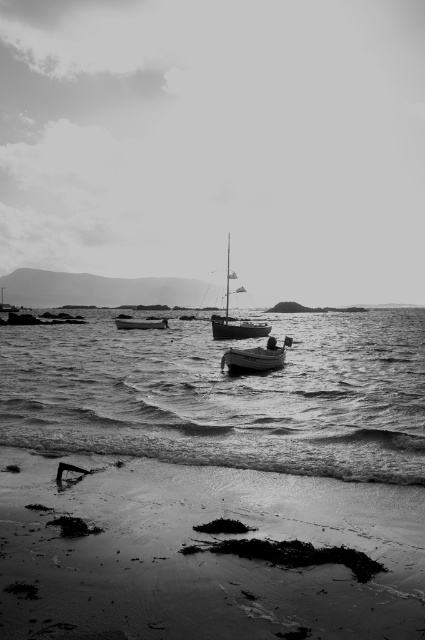
Image resolution: width=425 pixels, height=640 pixels. Describe the element at coordinates (235, 317) in the screenshot. I see `wooden sailboat at center` at that location.

Which is behind, point (241, 324) or point (119, 321)?

The point (119, 321) is behind.

The width and height of the screenshot is (425, 640). I want to click on wooden sailboat at center, so click(235, 317).

Does point (229, 349) lie behind point (149, 324)?

No, (229, 349) is closer to viewer.

Which is below, metallic gray boat at center or smooth wooden boat at center?

metallic gray boat at center is below.

Is point (246, 358) positioned after point (121, 321)?

No, it is in front of (121, 321).

Locate an element on the screen. metallic gray boat at center is located at coordinates (255, 356).

Does point (28, 531) lie in front of point (136, 324)?

That is True.

Based on the photo, can you confirm if smooth sand at lower center is positioned to the right of smooth wooden boat at center?

Correct, you'll find smooth sand at lower center to the right of smooth wooden boat at center.

Does point (65, 588) come closer to viewer compared to point (138, 324)?

Yes, it is in front of point (138, 324).

This screenshot has height=640, width=425. Find the location of `smooth sand at lower center`. smooth sand at lower center is located at coordinates (207, 554).